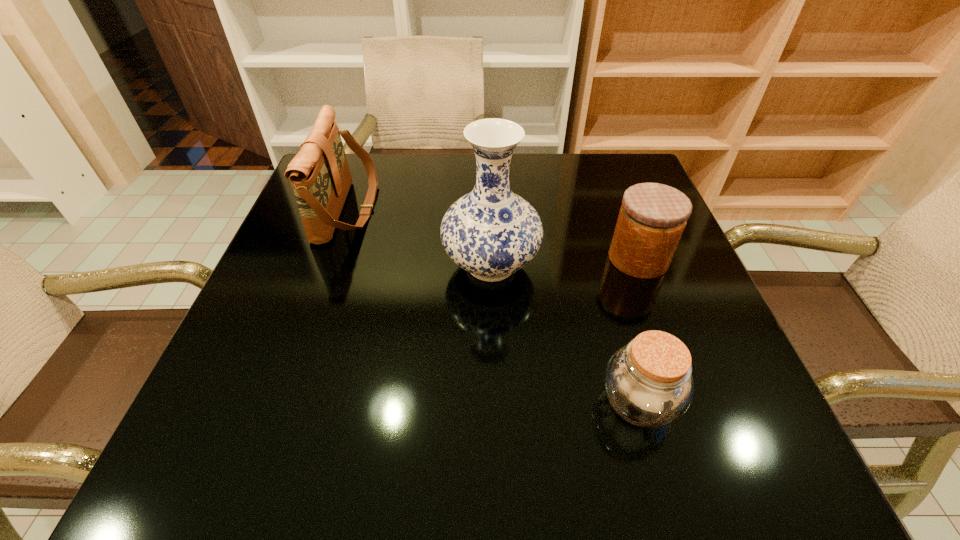
Identify the location of vacant space at the near right corner. Image resolution: width=960 pixels, height=540 pixels. (685, 473).

This screenshot has height=540, width=960. What are the coordinates of `free space between the farther jar and the vase` in the screenshot? It's located at (564, 262).

Where is `empty location between the nearest object and the farther jar`? empty location between the nearest object and the farther jar is located at coordinates (638, 331).

Find the location of `vacant area that lies between the nearer jar and the vase`. vacant area that lies between the nearer jar and the vase is located at coordinates (564, 334).

Image resolution: width=960 pixels, height=540 pixels. Identify the location of vacant point located between the shoulder bag and the nearer jar. (492, 306).

Find the location of a particular element. The image size is (960, 540). free space between the second object from left to right and the farther jar is located at coordinates (564, 262).

At what (x,y) coordinates should I click in order to perform the action: click on free point between the tallest object and the farther jar. Please return your answer as a coordinate pair (x, y). The height and width of the screenshot is (540, 960). Looking at the image, I should click on (564, 262).

Locate an element on the screen. Image resolution: width=960 pixels, height=540 pixels. free space between the nearest object and the third shortest object is located at coordinates (492, 306).

Where is `free spot between the nearer jar and the farther jar`? The width and height of the screenshot is (960, 540). free spot between the nearer jar and the farther jar is located at coordinates (638, 331).

Identify which object is the third nearest to the leftmost object. Please provide its 2D coordinates. Your answer should be formatted as a tuple, i.e. [(x, y)], where the tuple contains the x and y coordinates of a point satisfying the conditions above.

[(648, 382)]